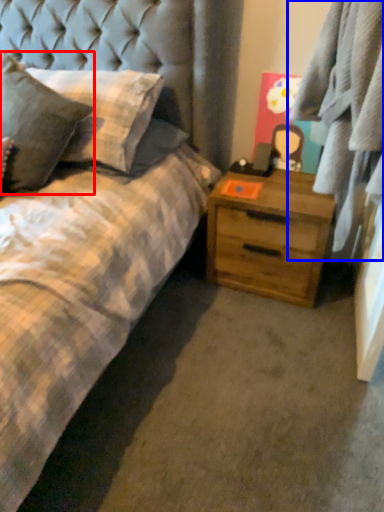
Question: Among these objects, which one is nearest to the camera, pillow (highlighted by a red box) or plaid (highlighted by a blue box)?

Choices:
 (A) pillow
 (B) plaid

Answer: (B)